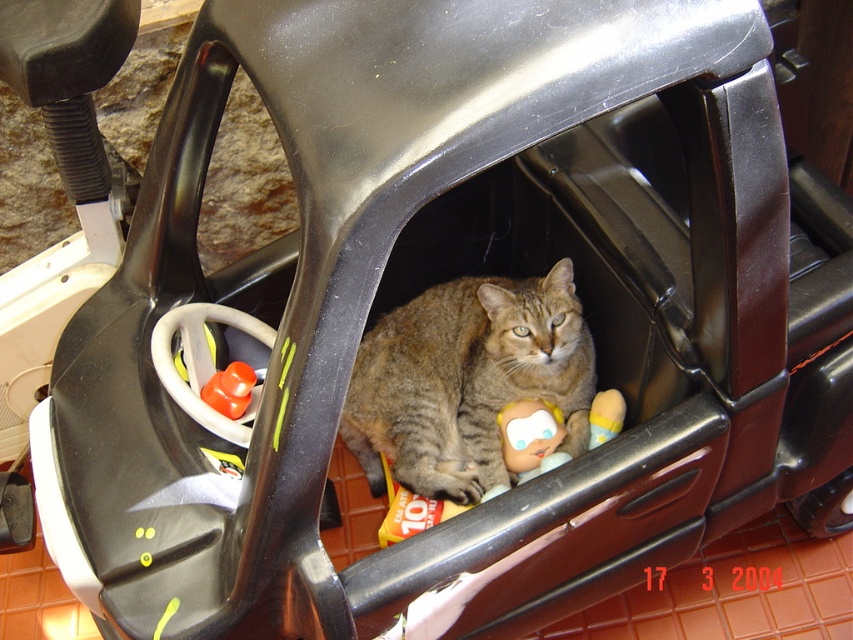
Does point (509, 416) come farther from viewer compared to point (252, 376)?

Yes, it is.

Between point (525, 472) and point (247, 404), which one is positioned behind?

Positioned behind is point (525, 472).

Does point (524, 413) come farther from viewer compared to point (241, 372)?

Yes, point (524, 413) is farther from viewer.

Locate an element on the screen. plastic baby doll at center is located at coordinates (529, 435).

Measure the distance from rubberized orange cup at center to smooth plastic doll at center.

The distance of rubberized orange cup at center from smooth plastic doll at center is 29.92 inches.

Does point (212, 387) lie in front of point (590, 449)?

That is True.

What are the coordinates of `rubberized orange cup at center` in the screenshot? It's located at (229, 388).

This screenshot has height=640, width=853. What do you see at coordinates (466, 380) in the screenshot?
I see `gray striped fur cat at center` at bounding box center [466, 380].

What do you see at coordinates (466, 380) in the screenshot?
I see `gray striped fur cat at center` at bounding box center [466, 380].

Where is `gray striped fur cat at center`? Image resolution: width=853 pixels, height=640 pixels. gray striped fur cat at center is located at coordinates (466, 380).